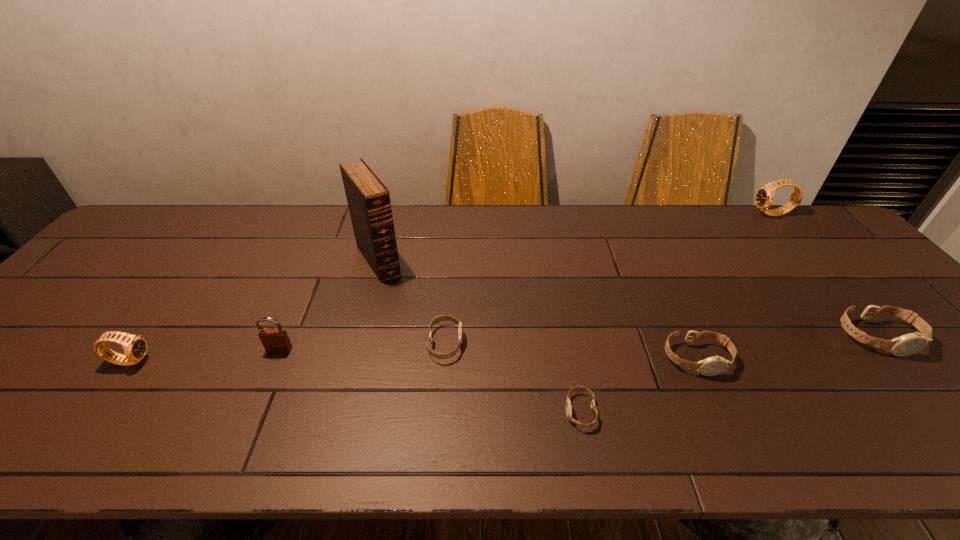
In order to click on vacant area situated on the front-facing side of the seventh object from right to left in this screenshot , I will do `click(240, 442)`.

At what (x,y) coordinates should I click in order to perform the action: click on free space located 0.090m on the face of the leftmost object. Please return your answer as a coordinate pair (x, y). Image resolution: width=960 pixels, height=540 pixels. Looking at the image, I should click on (189, 361).

This screenshot has width=960, height=540. I want to click on free space located on the face of the third tallest watch, so point(910,375).

Where is `free space located 0.100m on the face of the second biggest beige watch`? The height and width of the screenshot is (540, 960). free space located 0.100m on the face of the second biggest beige watch is located at coordinates (723, 417).

Image resolution: width=960 pixels, height=540 pixels. Identify the location of vacant space located on the face of the third biggest beige watch. (559, 343).

Locate an element on the screen. vacant region located 0.330m on the face of the nearest object is located at coordinates (407, 411).

You are a GUI agent. You are given a task and a screenshot of the screen. Output one action in this format:
    pyautogui.click(x=<x>, y=<y>)
    Task: Click on the vacant space located 0.310m on the face of the nearest object
    
    Given the screenshot: What is the action you would take?
    pyautogui.click(x=417, y=411)

Where is `vacant position located on the face of the nearest object`? vacant position located on the face of the nearest object is located at coordinates (479, 411).

I want to click on Bible that is at the far edge, so click(368, 199).

Find the location of a particular element. Image resolution: width=960 pixels, height=540 pixels. watch that is at the far edge is located at coordinates pos(764,197).